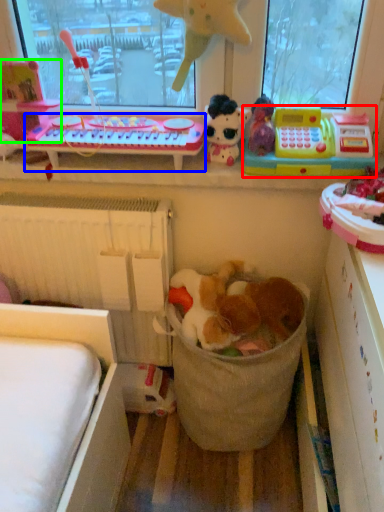
Question: Estimate the real-world distances between objects in this image. Which object is closer to toy (highlighted by a red box), changing table (highlighted by a blue box) or toy (highlighted by a green box)?

Choices:
 (A) changing table
 (B) toy

Answer: (A)